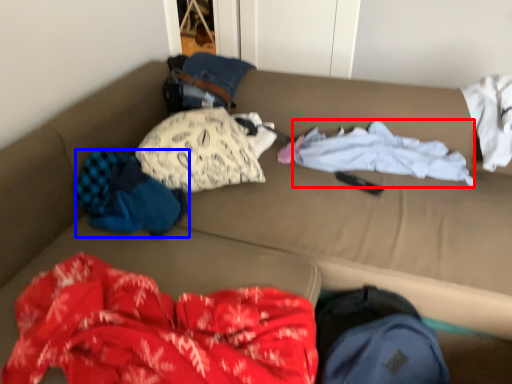
Question: Which of the following is the closest to the observer, clothing (highlighted by a red box) or clothing (highlighted by a blue box)?

Choices:
 (A) clothing
 (B) clothing

Answer: (B)